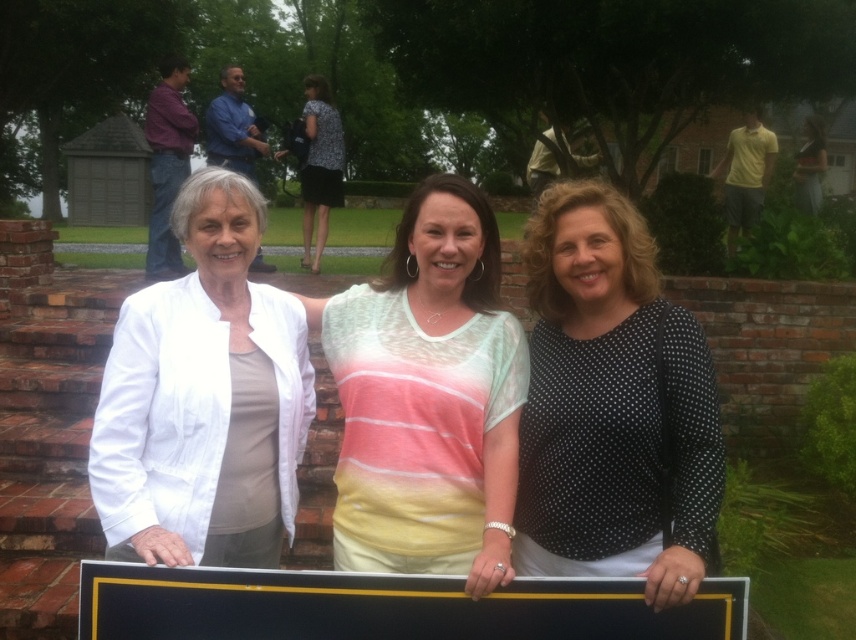
You are a photographer trying to adjust the composition of this photo. You want to ensure that the white matte jacket at left and the pastel striped shirt at center are both visible in the frame. Based on their heights, which one might you need to position closer to the camera to maintain visibility?

The white matte jacket at left has a lesser height compared to pastel striped shirt at center. To ensure both are visible, you should position the white matte jacket at left closer to the camera since it is shorter and might be obscured by the taller pastel striped shirt at center.

You are a photographer trying to capture a photo of the black matte plaque at center. The white matte jacket at left is blocking your view. Which direction should you move to avoid the obstruction?

The white matte jacket at left is to the left of the black matte plaque at center, so moving to the right side of the plaque would allow you to avoid the obstruction caused by the jacket.